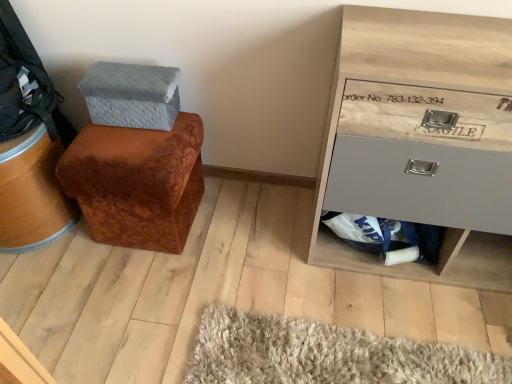
The image size is (512, 384). Identify the location of free point above brown velvety ottoman at left (from a real-world perspective). (128, 139).